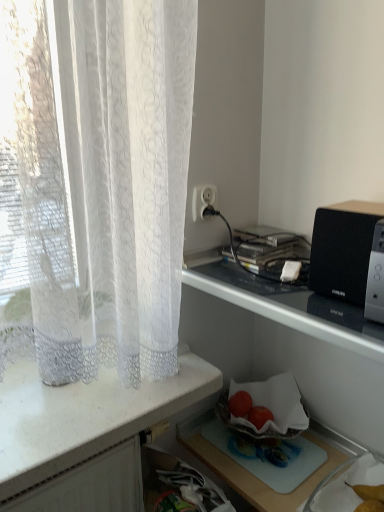
Where is `spots to the right of smooth red strawberries at center, which is the second fruit from left to right`? The image size is (384, 512). spots to the right of smooth red strawberries at center, which is the second fruit from left to right is located at coordinates click(x=301, y=443).